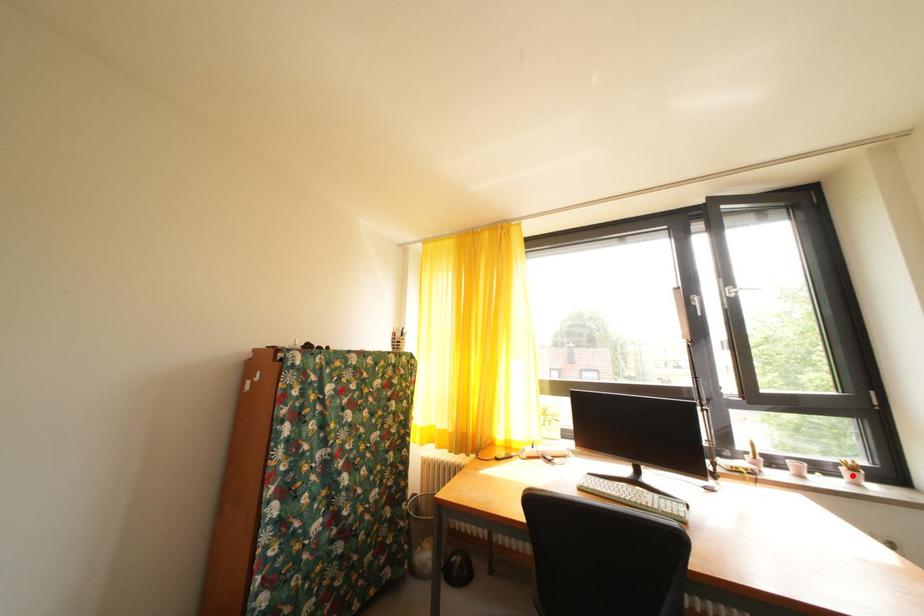
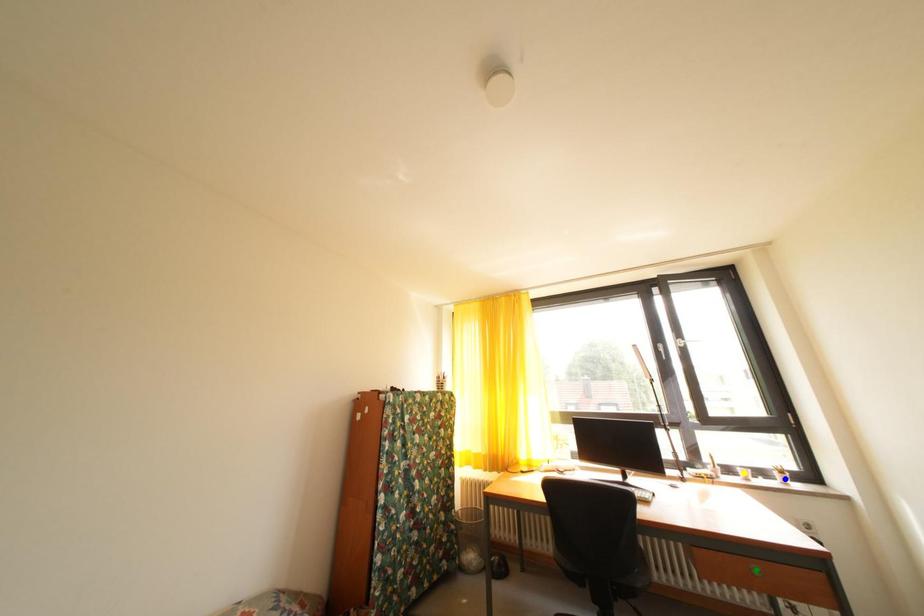
Question: I am providing you with two images of the same scene from different viewpoints. A red point is marked on the first image. You are given multiple points on the second image. Which point in image 2 is actually the same real-world point as the red point in image 1?

Choices:
 (A) yellow point
 (B) green point
 (C) blue point

Answer: (C)